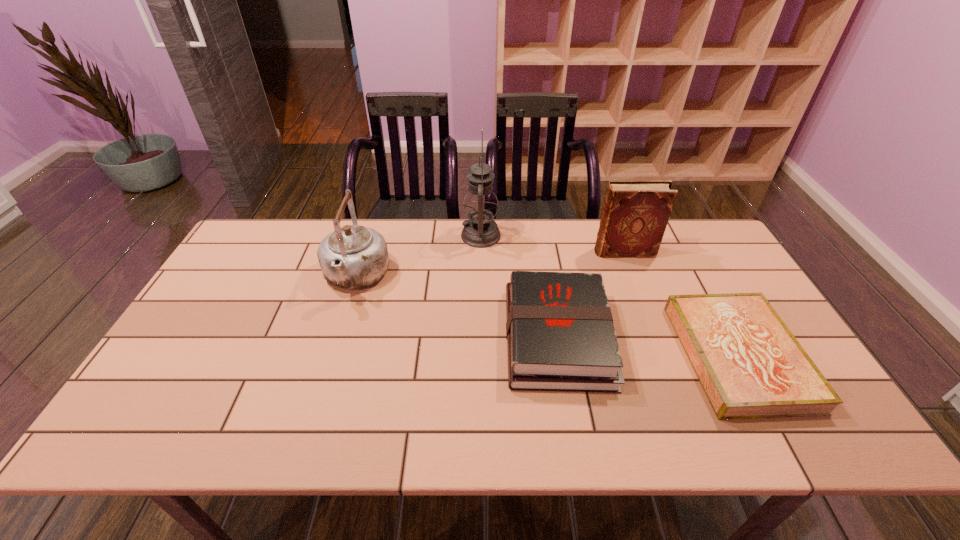
Identify the location of vacant space located on the spine side of the tallest hardback book. (576, 252).

Locate an element on the screen. The height and width of the screenshot is (540, 960). blank space located 0.320m on the right of the leftmost hardback book is located at coordinates (731, 338).

Find the location of `free space located 0.380m on the back of the shortest object`. free space located 0.380m on the back of the shortest object is located at coordinates (669, 227).

At what (x,y) coordinates should I click in order to perform the action: click on oil lamp positioned at the far edge. Please return your answer as a coordinate pair (x, y). This screenshot has height=540, width=960. Looking at the image, I should click on (480, 204).

At what (x,y) coordinates should I click in order to perform the action: click on kettle that is at the far edge. Please return your answer as a coordinate pair (x, y). Looking at the image, I should click on (352, 257).

At what (x,y) coordinates should I click in order to perform the action: click on hardback book that is at the far edge. Please return your answer as a coordinate pair (x, y). Looking at the image, I should click on (635, 214).

Locate an element on the screen. The image size is (960, 540). object positioned at the near edge is located at coordinates (750, 365).

You are a GUI agent. You are given a task and a screenshot of the screen. Output one action in this format:
    pyautogui.click(x=<x>, y=<y>)
    Task: Click on the object present at the right edge
    This screenshot has width=960, height=540.
    Given the screenshot: What is the action you would take?
    pyautogui.click(x=750, y=365)

Find the location of a particular element. The height and width of the screenshot is (540, 960). object situated at the near right corner is located at coordinates (750, 365).

What are the coordinates of `vacant space at the far edge` in the screenshot? It's located at (512, 246).